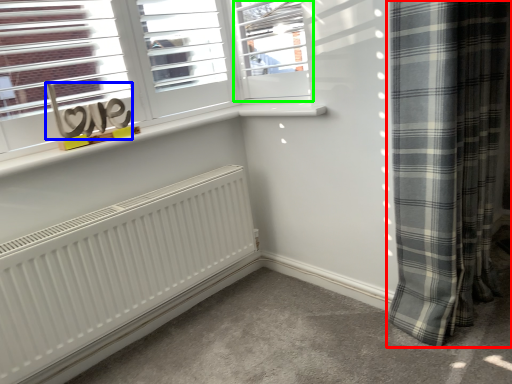
Question: Which object is positioned closest to curtain (highlighted by a red box)? Select from writing (highlighted by a blue box) and window (highlighted by a green box).

Choices:
 (A) writing
 (B) window

Answer: (B)